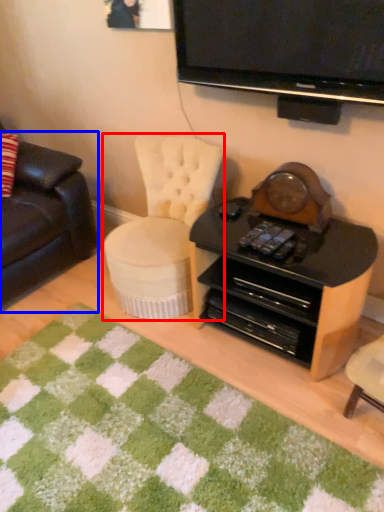
Question: Which object appears closest to the camera in this image, chair (highlighted by a red box) or studio couch (highlighted by a blue box)?

Choices:
 (A) chair
 (B) studio couch

Answer: (A)